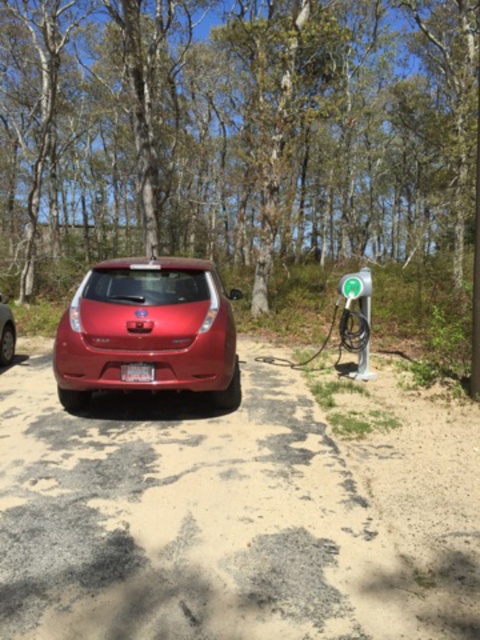
Is the position of glossy red car at center more distant than that of shiny red car at center?

No, glossy red car at center is in front of shiny red car at center.

Which of these two, glossy red car at center or shiny red car at center, stands taller?

glossy red car at center

You are a GUI agent. You are given a task and a screenshot of the screen. Output one action in this format:
    pyautogui.click(x=<x>, y=<y>)
    Task: Click on the glossy red car at center
    This screenshot has height=640, width=480.
    Given the screenshot: What is the action you would take?
    pyautogui.click(x=147, y=332)

Does glossy red car at center lie in front of green plastic parking meter at center?

That is True.

Which is behind, point (164, 289) or point (358, 289)?

The point (358, 289) is behind.

The height and width of the screenshot is (640, 480). Identify the location of glossy red car at center. (147, 332).

Is green plastic parking meter at center to the right of shiny red car at center from the viewer's perspective?

Correct, you'll find green plastic parking meter at center to the right of shiny red car at center.

Can you confirm if green plastic parking meter at center is thinner than shiny red car at center?

No, green plastic parking meter at center is not thinner than shiny red car at center.

Between point (371, 273) and point (9, 310), which one is positioned in front?

Point (9, 310) is in front.

Image resolution: width=480 pixels, height=640 pixels. Identify the location of green plastic parking meter at center. (358, 291).